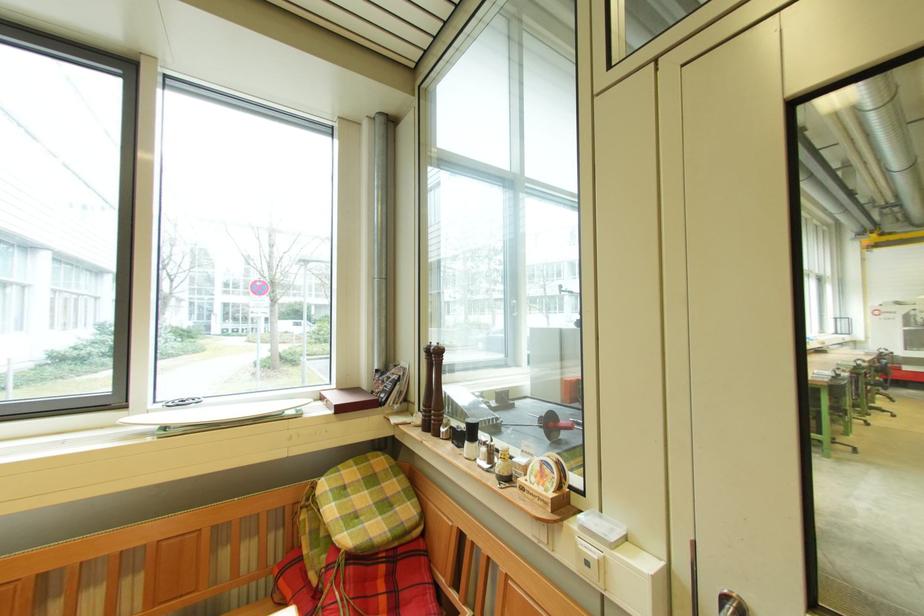
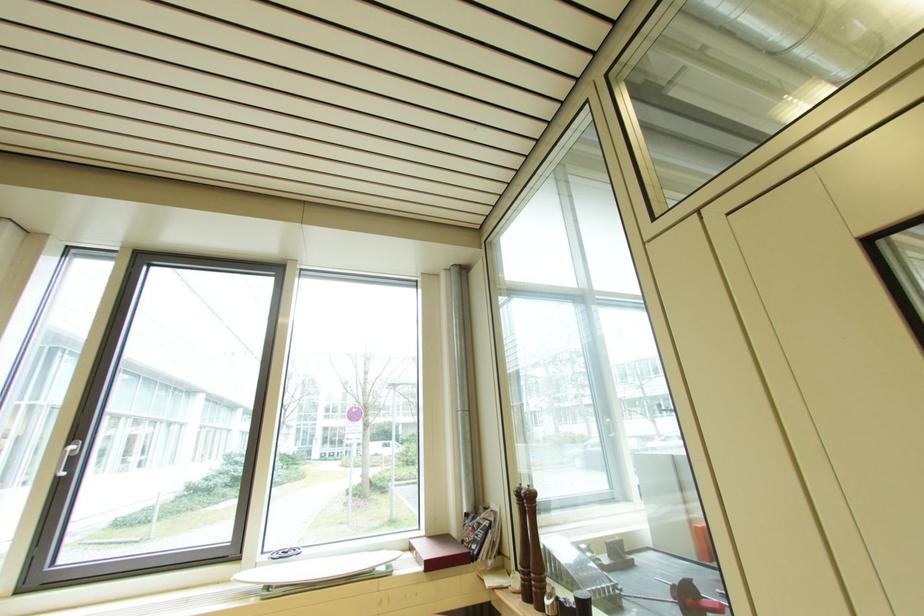
Find the pixel in the second image that matches (549,419) in the first image.

(681, 589)